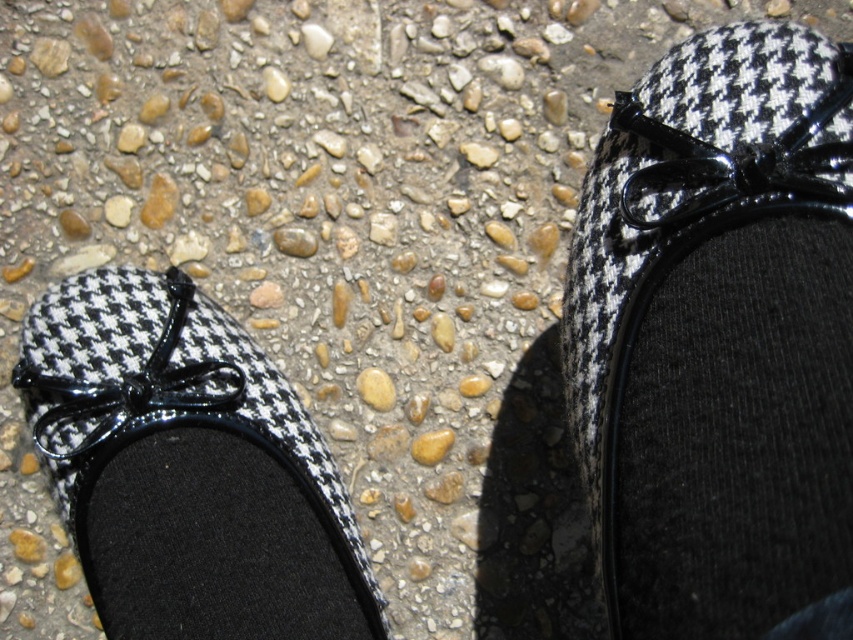
Question: Which point is farther from the camera taking this photo?

Choices:
 (A) (346, 538)
 (B) (625, 102)

Answer: (A)

Question: Can you confirm if houndstooth fabric shoe at upper right is wider than houndstooth fabric shoe at lower left?

Choices:
 (A) yes
 (B) no

Answer: (B)

Question: Which point is closer to the camera?

Choices:
 (A) coord(48,403)
 (B) coord(840,520)

Answer: (B)

Question: Is houndstooth fabric shoe at upper right closer to the viewer compared to houndstooth fabric shoe at lower left?

Choices:
 (A) yes
 (B) no

Answer: (A)

Question: Among these points, which one is farthest from the camera?

Choices:
 (A) (325, 465)
 (B) (700, 72)

Answer: (A)

Question: Is houndstooth fabric shoe at upper right wider than houndstooth fabric shoe at lower left?

Choices:
 (A) no
 (B) yes

Answer: (A)